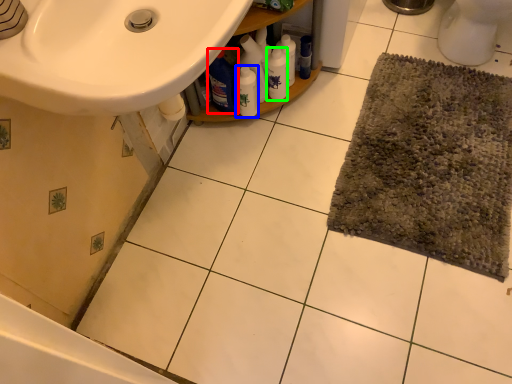
Question: Considering the real-world distances, which object is closest to cleaning product (highlighted by a red box)? bottle (highlighted by a blue box) or cleaning product (highlighted by a green box).

Choices:
 (A) bottle
 (B) cleaning product

Answer: (A)